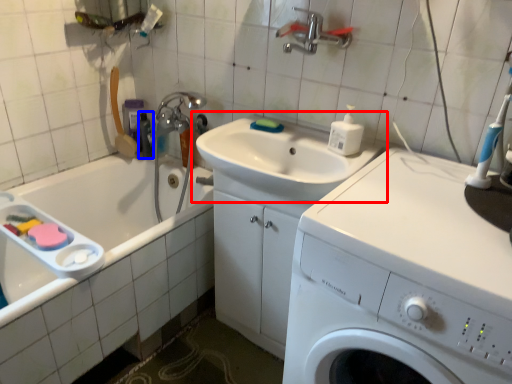
Question: Which point is closer to the camera, sink (highlighted by a red box) or toiletry (highlighted by a blue box)?

Choices:
 (A) sink
 (B) toiletry

Answer: (A)